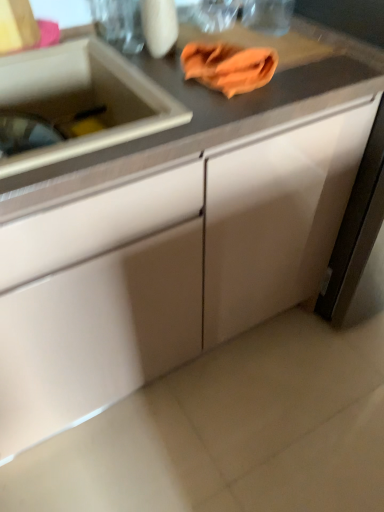
Identify the location of empty space that is to the right of orange cloth at upper center. This screenshot has width=384, height=512. (308, 73).